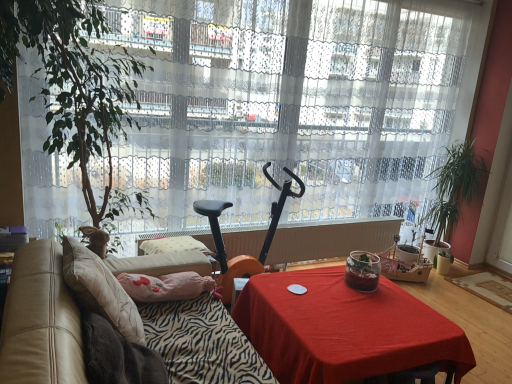
Question: Is red fabric table at center completely or partially inside leather at left?

Choices:
 (A) no
 (B) yes

Answer: (A)

Question: Considering the relative sizes of leather at left and red fabric table at center in the image provided, is leather at left shorter than red fabric table at center?

Choices:
 (A) yes
 (B) no

Answer: (B)

Question: From a real-world perspective, is leather at left physically below red fabric table at center?

Choices:
 (A) no
 (B) yes

Answer: (A)

Question: Does leather at left appear on the right side of red fabric table at center?

Choices:
 (A) yes
 (B) no

Answer: (B)

Question: Does leather at left have a larger size compared to red fabric table at center?

Choices:
 (A) no
 (B) yes

Answer: (B)

Question: From the image's perspective, is leather at left below red fabric table at center?

Choices:
 (A) no
 (B) yes

Answer: (A)

Question: Is there a large distance between zebra-patterned fabric at lower left and beige fabric pillow at left?

Choices:
 (A) yes
 (B) no

Answer: (B)

Question: Is zebra-patterned fabric at lower left looking in the opposite direction of beige fabric pillow at left?

Choices:
 (A) yes
 (B) no

Answer: (B)

Question: Is zebra-patterned fabric at lower left thinner than beige fabric pillow at left?

Choices:
 (A) yes
 (B) no

Answer: (B)

Question: From the image's perspective, is zebra-patterned fabric at lower left on top of beige fabric pillow at left?

Choices:
 (A) no
 (B) yes

Answer: (A)

Question: Is zebra-patterned fabric at lower left at the right side of beige fabric pillow at left?

Choices:
 (A) yes
 (B) no

Answer: (A)

Question: Can you confirm if zebra-patterned fabric at lower left is bigger than beige fabric pillow at left?

Choices:
 (A) yes
 (B) no

Answer: (B)

Question: Considering the relative sizes of green leafy plant at right, the second houseplant when ordered from left to right, and leather at left in the image provided, is green leafy plant at right, the second houseplant when ordered from left to right, bigger than leather at left?

Choices:
 (A) no
 (B) yes

Answer: (A)